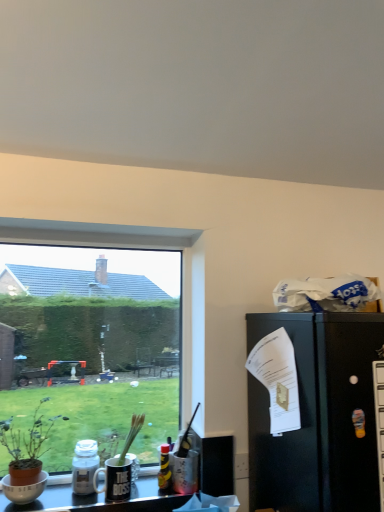
This screenshot has height=512, width=384. Describe the element at coordinates (27, 446) in the screenshot. I see `brown terracotta pot at left` at that location.

Image resolution: width=384 pixels, height=512 pixels. What are the coordinates of `metallic silver desk at lower center` in the screenshot? It's located at (101, 500).

Identify the location of matte white bowl at lower left. (24, 489).

Between translucent plastic bottle at center, arranged as the 1th bottle when viewed from the right, and translucent glass bottle at lower left, the 1th bottle viewed from the left, which one appears on the right side from the viewer's perspective?

Positioned to the right is translucent plastic bottle at center, arranged as the 1th bottle when viewed from the right.

Looking at their sizes, would you say translucent plastic bottle at center, arranged as the 1th bottle when viewed from the right, is wider or thinner than translucent glass bottle at lower left, which appears as the 2th bottle when viewed from the right?

Considering their sizes, translucent plastic bottle at center, arranged as the 1th bottle when viewed from the right, looks slimmer than translucent glass bottle at lower left, which appears as the 2th bottle when viewed from the right.

Does point (165, 486) come closer to viewer compared to point (92, 450)?

No, (165, 486) is further to viewer.

From a real-world perspective, which object rests below the other?

From a 3D spatial view, translucent plastic bottle at center, placed as the second bottle when sorted from left to right, is below.

The height and width of the screenshot is (512, 384). I want to click on the 2nd bottle located beneath the brown terracotta pot at left (from a real-world perspective), so [164, 469].

Is brown terracotta pot at left oriented towards translucent plastic bottle at center, arranged as the 1th bottle when viewed from the right?

No.

Is point (27, 470) closer to camera compared to point (169, 486)?

Yes, it is in front of point (169, 486).

Are brown terracotta pot at left and translucent plastic bottle at center, placed as the second bottle when sorted from left to right, far apart?

No, brown terracotta pot at left is in close proximity to translucent plastic bottle at center, placed as the second bottle when sorted from left to right.

Find the location of a particular element. The image size is (384, 512). houseplant in front of the matte white bowl at lower left is located at coordinates (27, 446).

Which object is further away from the camera taking this photo, brown terracotta pot at left or matte white bowl at lower left?

Positioned behind is matte white bowl at lower left.

Between brown terracotta pot at left and matte white bowl at lower left, which one has larger width?

brown terracotta pot at left is wider.

From a real-world perspective, who is located lower, brown terracotta pot at left or matte white bowl at lower left?

matte white bowl at lower left.

Are black matte refrigerator at right and brown terracotta pot at left making contact?

No, black matte refrigerator at right is not in contact with brown terracotta pot at left.

Which is behind, point (317, 384) or point (12, 459)?

The point (12, 459) is farther.

Is black matte refrigerator at right oriented away from brown terracotta pot at left?

black matte refrigerator at right does not have its back to brown terracotta pot at left.

Is point (104, 253) behind point (26, 459)?

That is True.

Are transparent glass window at lower left and brown terracotta pot at left far apart?

No, transparent glass window at lower left is not far away from brown terracotta pot at left.

Is transparent glass window at lower left positioned beyond the bounds of brown terracotta pot at left?

Indeed, transparent glass window at lower left is completely outside brown terracotta pot at left.

Who is bigger, transparent glass window at lower left or brown terracotta pot at left?

With larger size is transparent glass window at lower left.

Considering the relative sizes of metallic silver desk at lower center and brown terracotta pot at left in the image provided, is metallic silver desk at lower center smaller than brown terracotta pot at left?

Yes.

Which object is wider, metallic silver desk at lower center or brown terracotta pot at left?

metallic silver desk at lower center.

Which is more to the right, metallic silver desk at lower center or brown terracotta pot at left?

metallic silver desk at lower center is more to the right.

Is point (164, 497) closer to camera compared to point (7, 420)?

No, (164, 497) is further to viewer.

Does translucent glass bottle at lower left, which appears as the 2th bottle when viewed from the right, have a lesser height compared to transparent glass window at lower left?

Yes.

Looking at the image, does translucent glass bottle at lower left, the 1th bottle viewed from the left, seem bigger or smaller compared to transparent glass window at lower left?

In the image, translucent glass bottle at lower left, the 1th bottle viewed from the left, appears to be smaller than transparent glass window at lower left.

Is transparent glass window at lower left surrounded by translucent glass bottle at lower left, which appears as the 2th bottle when viewed from the right?

No, translucent glass bottle at lower left, which appears as the 2th bottle when viewed from the right, does not contain transparent glass window at lower left.

Which is less distant, (98, 462) or (113, 320)?

Point (98, 462).

Image resolution: width=384 pixels, height=512 pixels. Find the location of `bottle on the right of translucent glass bottle at lower left, which appears as the 2th bottle when viewed from the right`. bottle on the right of translucent glass bottle at lower left, which appears as the 2th bottle when viewed from the right is located at coordinates (164, 469).

Locate an element on the screen. houseplant that appears in front of the translucent plastic bottle at center, placed as the second bottle when sorted from left to right is located at coordinates (27, 446).

Which object lies further to the anchor point translucent plastic bottle at center, arranged as the 1th bottle when viewed from the right, translucent glass bottle at lower left, which appears as the 2th bottle when viewed from the right, or black matte refrigerator at right?

black matte refrigerator at right is positioned further to the anchor translucent plastic bottle at center, arranged as the 1th bottle when viewed from the right.

Estimate the real-world distances between objects in this image. Which object is closer to translucent glass bottle at lower left, which appears as the 2th bottle when viewed from the right, metallic silver desk at lower center or translucent plastic bottle at center, arranged as the 1th bottle when viewed from the right?

Among the two, metallic silver desk at lower center is located nearer to translucent glass bottle at lower left, which appears as the 2th bottle when viewed from the right.

Considering their positions, is black matte refrigerator at right positioned closer to translucent glass bottle at lower left, which appears as the 2th bottle when viewed from the right, than metallic silver desk at lower center?

Based on the image, metallic silver desk at lower center appears to be nearer to translucent glass bottle at lower left, which appears as the 2th bottle when viewed from the right.

Consider the image. Considering their positions, is matte white bowl at lower left positioned closer to metallic silver desk at lower center than transparent glass window at lower left?

matte white bowl at lower left.

Considering their positions, is black matte refrigerator at right positioned closer to transparent glass window at lower left than brown terracotta pot at left?

brown terracotta pot at left is positioned closer to the anchor transparent glass window at lower left.

From the image, which object appears to be nearer to brown terracotta pot at left, black matte refrigerator at right or matte white bowl at lower left?

Among the two, matte white bowl at lower left is located nearer to brown terracotta pot at left.

When comparing their distances from metallic silver desk at lower center, does translucent plastic bottle at center, arranged as the 1th bottle when viewed from the right, or transparent glass window at lower left seem further?

Among the two, transparent glass window at lower left is located further to metallic silver desk at lower center.

Based on their spatial positions, is transparent glass window at lower left or brown terracotta pot at left closer to translucent plastic bottle at center, placed as the second bottle when sorted from left to right?

Among the two, brown terracotta pot at left is located nearer to translucent plastic bottle at center, placed as the second bottle when sorted from left to right.

Where is `window situated between matte white bowl at lower left and black matte refrigerator at right from left to right`? window situated between matte white bowl at lower left and black matte refrigerator at right from left to right is located at coordinates (92, 335).

I want to click on desk between transparent glass window at lower left and black matte refrigerator at right, so click(x=101, y=500).

Locate an element on the screen. houseplant between transparent glass window at lower left and translucent glass bottle at lower left, which appears as the 2th bottle when viewed from the right, vertically is located at coordinates (27, 446).

This screenshot has width=384, height=512. In order to click on desk between translucent glass bottle at lower left, the 1th bottle viewed from the left, and translucent plastic bottle at center, placed as the second bottle when sorted from left to right, from left to right in this screenshot , I will do `click(101, 500)`.